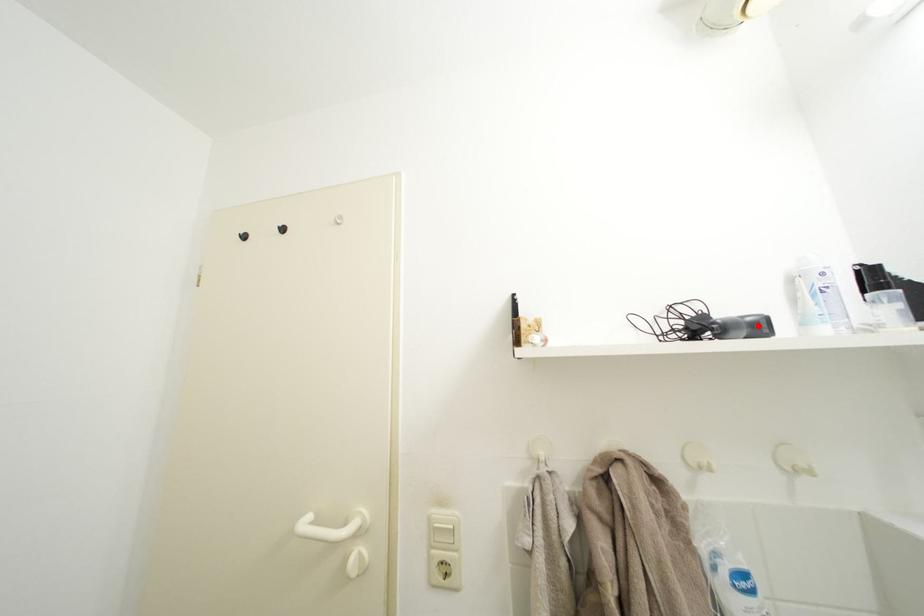
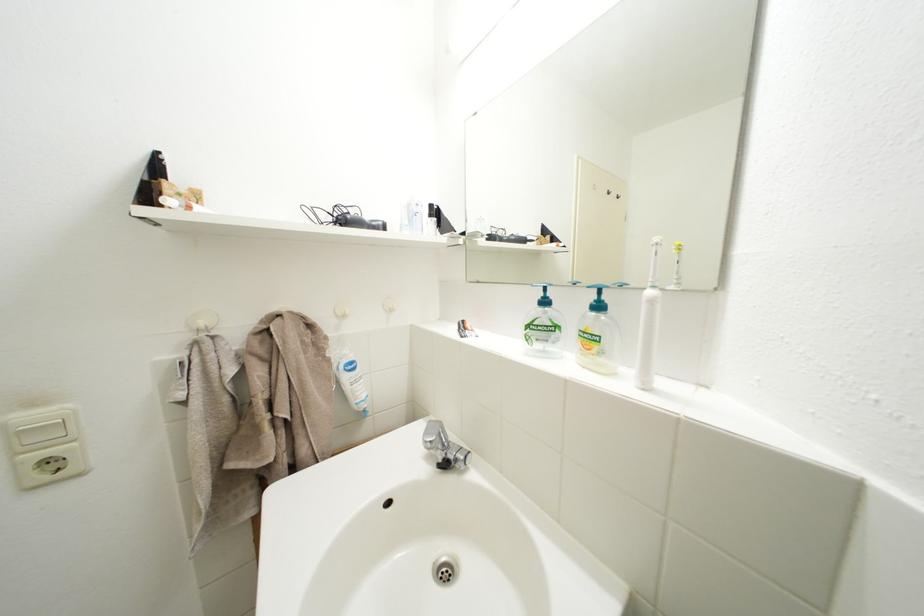
The point at the highlighted location is marked in the first image. Where is the corresponding point in the second image?

(383, 228)